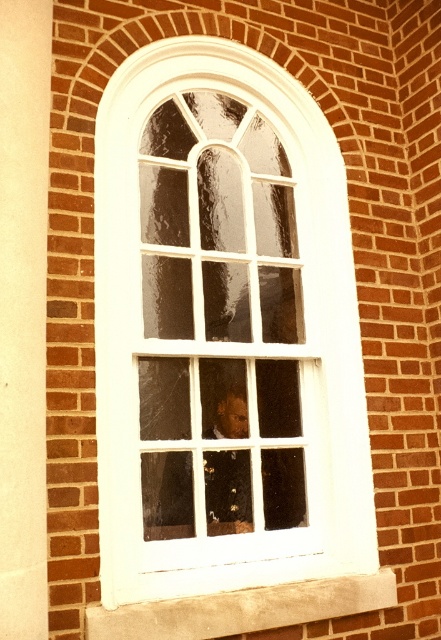
You are standing in front of a brick wall with an arched window. The white matte window frame at center is positioned at coordinates approximately 0.519 on the x and 0.508 on the y axis. If you want to place a decorative plaque exactly at the center of the window frame, where should you aim relative to the brick wall?

The white matte window frame at center is located at point (224,332), so you should aim for those coordinates on the brick wall to place the decorative plaque exactly at the center of the window frame.

You are standing in front of the arched window and see both the smooth skin face at center and the white concrete at lower center. Which object is positioned more to the left side?

The smooth skin face at center is positioned more to the left side than the white concrete at lower center.